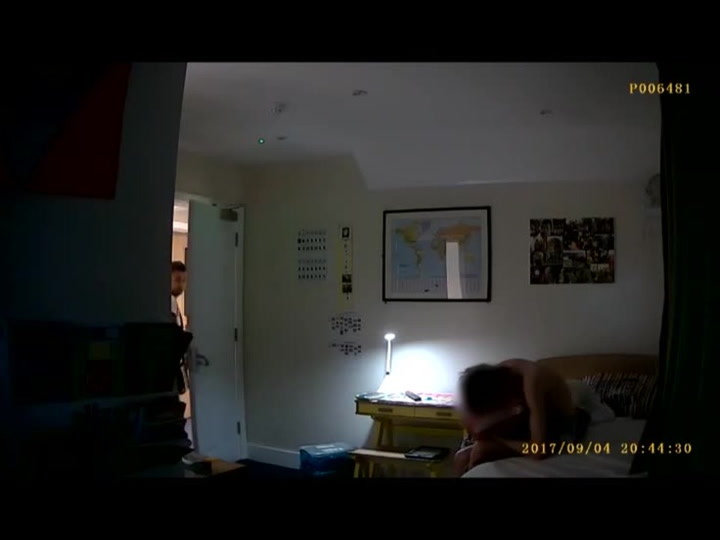
Locate an element on the screen. wall is located at coordinates (302, 324).